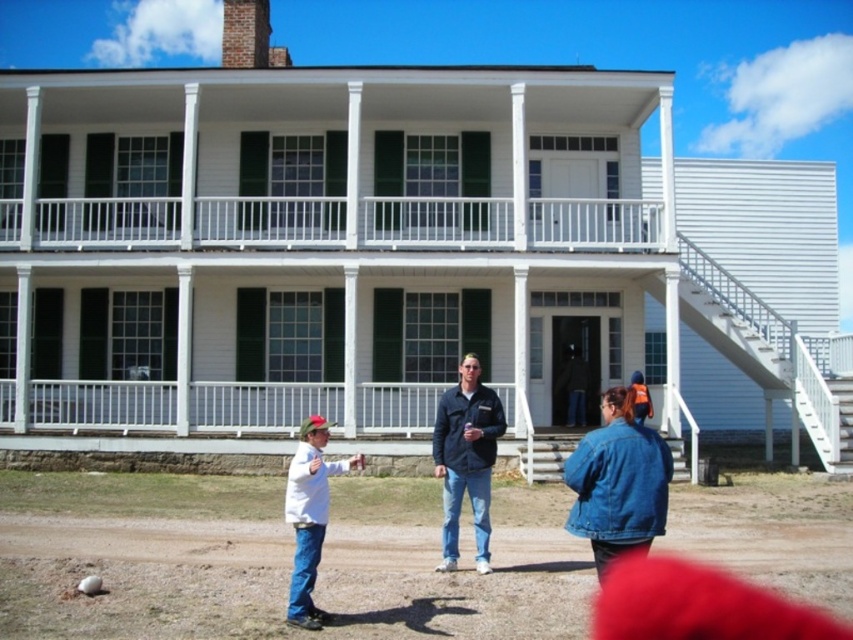
Question: Is dark blue jacket at center wider than white matte shirt at lower left?

Choices:
 (A) no
 (B) yes

Answer: (B)

Question: Estimate the real-world distances between objects in this image. Which object is closer to the white matte shirt at lower left?

Choices:
 (A) white painted wood porch at upper center
 (B) dark blue jacket at center

Answer: (B)

Question: Estimate the real-world distances between objects in this image. Which object is farther from the white painted wood porch at upper center?

Choices:
 (A) white matte shirt at lower left
 (B) dark blue jacket at center

Answer: (A)

Question: Estimate the real-world distances between objects in this image. Which object is closer to the white painted wood porch at upper center?

Choices:
 (A) white matte shirt at lower left
 (B) dark blue jacket at center

Answer: (B)

Question: Is dark blue jacket at center further to camera compared to white matte shirt at lower left?

Choices:
 (A) no
 (B) yes

Answer: (B)

Question: Does white painted wood porch at upper center appear on the left side of white matte shirt at lower left?

Choices:
 (A) no
 (B) yes

Answer: (B)